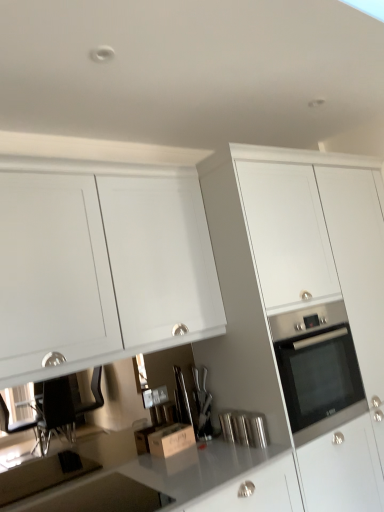
Question: From the image's perspective, relative to satin silver knife block at center, which is the 1th appliance in left-to-right order, is polished stainless steel canister at center, the second appliance from the left, above or below?

Choices:
 (A) above
 (B) below

Answer: (B)

Question: In terms of width, does polished stainless steel canister at center, the second appliance from the left, look wider or thinner when compared to satin silver knife block at center, marked as the second appliance in a front-to-back arrangement?

Choices:
 (A) thin
 (B) wide

Answer: (B)

Question: Which object is positioned closest to the white glossy cabinet at center, the 1th cabinetry when ordered from right to left?

Choices:
 (A) polished stainless steel canister at center, the second appliance from the left
 (B) white matte cabinet at upper left, the first cabinetry from the left
 (C) satin silver knife block at center, which is the 1th appliance in left-to-right order
 (D) wooden cardboard box at center

Answer: (B)

Question: Considering the real-world distances, which object is farthest from the wooden cardboard box at center?

Choices:
 (A) white glossy cabinet at center, the 1th cabinetry when ordered from right to left
 (B) polished stainless steel canister at center, which ranks as the 1th appliance in front-to-back order
 (C) satin silver knife block at center, which is counted as the 1th appliance, starting from the back
 (D) white matte cabinet at upper left, the first cabinetry from the left

Answer: (D)